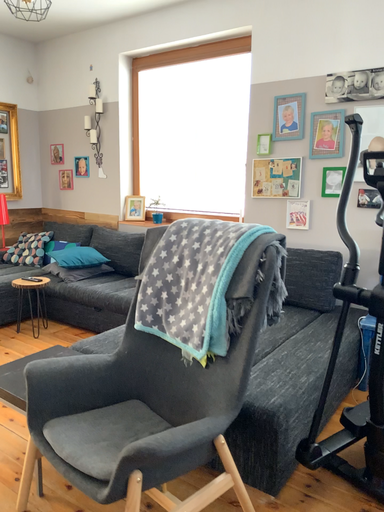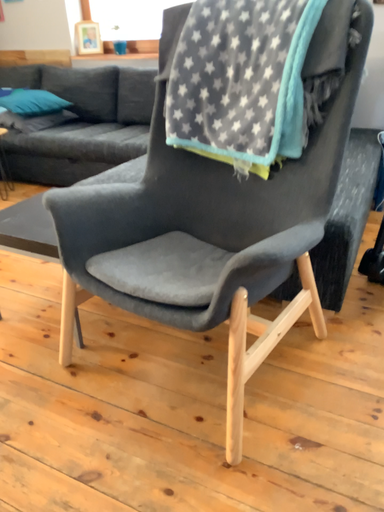
Question: Which way did the camera rotate in the video?

Choices:
 (A) rotated downward
 (B) rotated upward

Answer: (A)